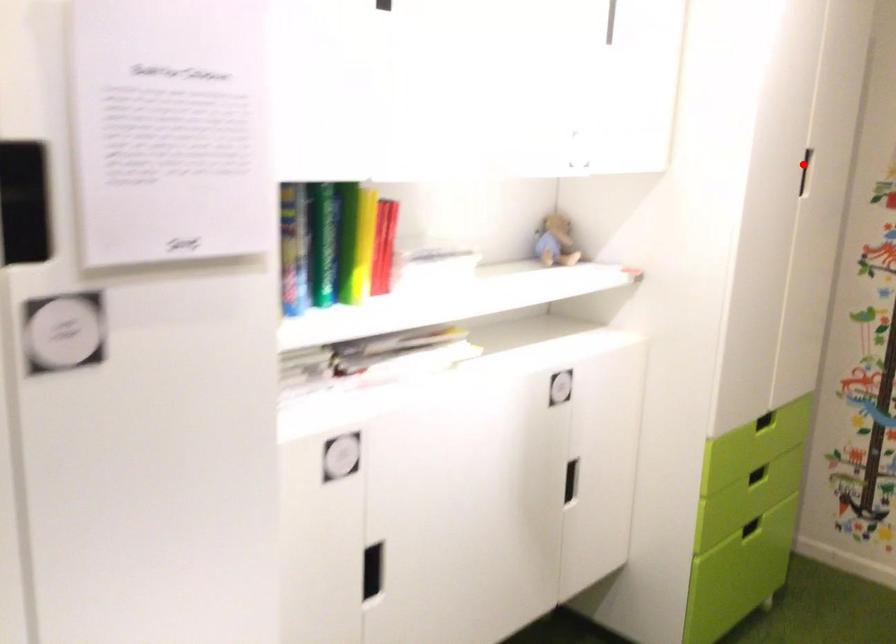
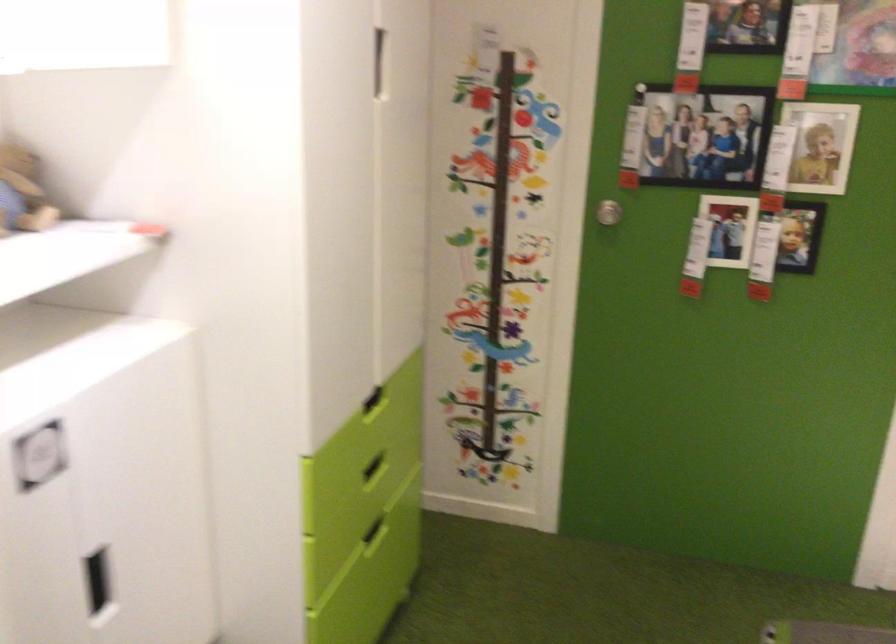
Locate, in the second image, the point that corresponds to the highlighted location in the first image.

(377, 61)